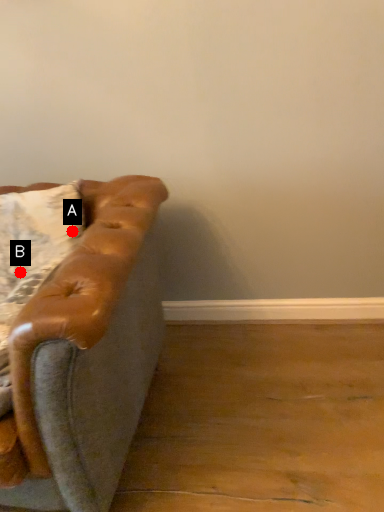
Question: Two points are circled on the image, labeled by A and B beside each circle. Which of the following is the closest to the observer?

Choices:
 (A) A is closer
 (B) B is closer

Answer: (A)